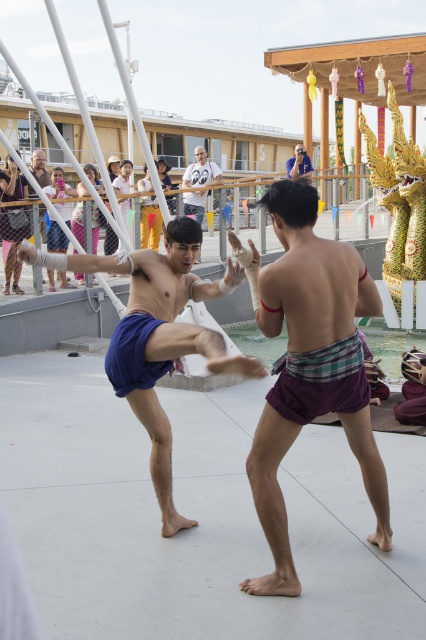
Question: Which object is farther from the camera taking this photo?

Choices:
 (A) purple plaid shorts at center
 (B) white cotton shirt at center
 (C) blue cotton shorts at center
 (D) light blue shirt at upper center

Answer: (B)

Question: Which object is closer to the camera taking this photo?

Choices:
 (A) light blue shirt at upper center
 (B) blue cotton shorts at center

Answer: (B)

Question: Which point is closer to the camera taking this photo?

Choices:
 (A) (298, 147)
 (B) (196, 148)

Answer: (B)

Question: Can you confirm if purple plaid shorts at center is wider than blue cotton shorts at center?

Choices:
 (A) no
 (B) yes

Answer: (A)

Question: Can you confirm if purple plaid shorts at center is wider than white cotton shirt at center?

Choices:
 (A) yes
 (B) no

Answer: (A)

Question: Is purple plaid shorts at center positioned at the back of white cotton shirt at center?

Choices:
 (A) no
 (B) yes

Answer: (A)